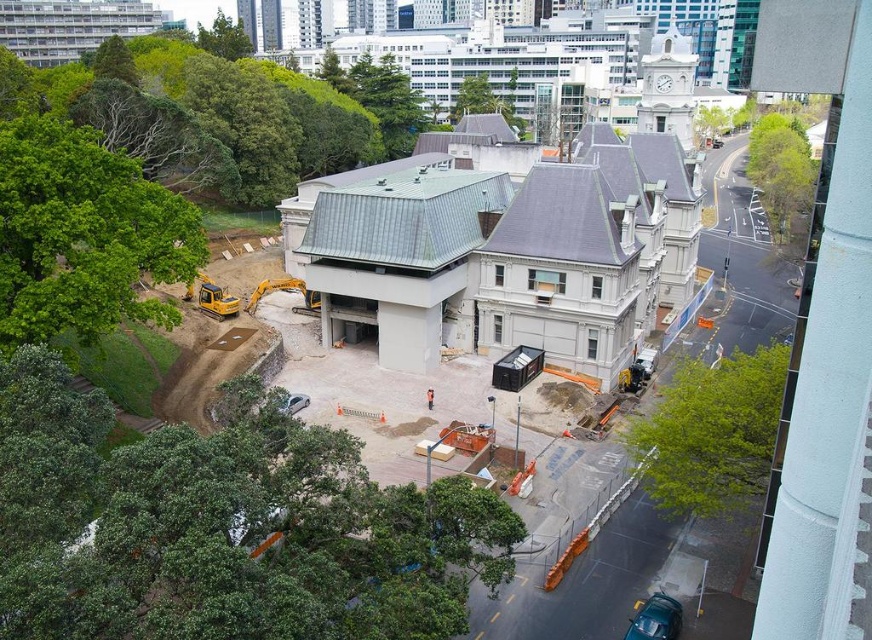
Image resolution: width=872 pixels, height=640 pixels. Describe the element at coordinates (222, 525) in the screenshot. I see `green leafy tree at lower left` at that location.

Does green leafy tree at lower left have a larger size compared to green leafy tree at center?

No, green leafy tree at lower left is not bigger than green leafy tree at center.

Where is `green leafy tree at lower left`? green leafy tree at lower left is located at coordinates (222, 525).

Which is more to the right, green leafy tree at lower left or green leafy tree at upper center?

green leafy tree at upper center

Is point (196, 520) positioned after point (698, 108)?

No.

Locate an element on the screen. green leafy tree at lower left is located at coordinates (222, 525).

Does green leafy tree at upper left have a greater width compared to green leafy tree at upper center?

No.

Is point (237, 35) farther from viewer compared to point (707, 120)?

No.

Locate an element on the screen. Image resolution: width=872 pixels, height=640 pixels. green leafy tree at upper left is located at coordinates (223, 36).